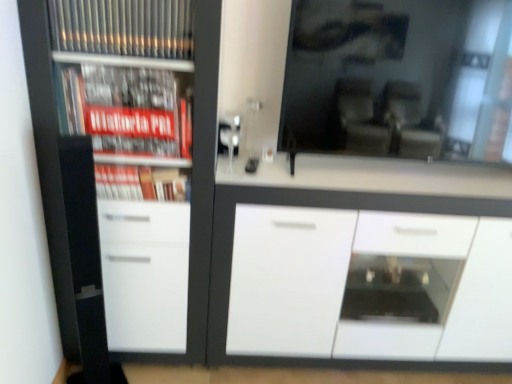
The height and width of the screenshot is (384, 512). Describe the element at coordinates (131, 161) in the screenshot. I see `white glossy cupboard at left` at that location.

At what (x,y) coordinates should I click in order to perform the action: click on white glossy cabinet at center. Please return your answer as a coordinate pair (x, y). Looking at the image, I should click on (360, 280).

At what (x,y) coordinates should I click in order to perform the action: click on white glossy cupboard at left. Please return your answer as a coordinate pair (x, y). The image size is (512, 384). Looking at the image, I should click on (131, 161).

What are the coordinates of `mirror behind the white glossy cupboard at left` in the screenshot? It's located at (399, 78).

Considering the positions of points (148, 350) and (308, 58), is point (148, 350) farther from camera compared to point (308, 58)?

Yes, it is behind point (308, 58).

How different are the orientations of white glossy cupboard at left and transparent glass mirror at upper center in degrees?

They differ by 0.208 degrees in their facing directions.

Considering the sizes of objects white glossy cupboard at left and transparent glass mirror at upper center in the image provided, who is bigger, white glossy cupboard at left or transparent glass mirror at upper center?

With larger size is white glossy cupboard at left.

Is point (259, 311) farther from camera compared to point (379, 144)?

Yes.

Which object is thinner, white glossy cabinet at center or transparent glass mirror at upper center?

Thinner between the two is transparent glass mirror at upper center.

From a real-world perspective, is white glossy cabinet at center above or below transparent glass mirror at upper center?

From a real-world perspective, white glossy cabinet at center is physically below transparent glass mirror at upper center.

Can you confirm if white glossy cabinet at center is thinner than white glossy cupboard at left?

No, white glossy cabinet at center is not thinner than white glossy cupboard at left.

Considering the positions of points (245, 311) and (54, 7), is point (245, 311) closer to camera compared to point (54, 7)?

That is False.

There is a white glossy cabinet at center. At what (x,y) coordinates should I click in order to perform the action: click on cupboard above it (from a real-world perspective). Please return your answer as a coordinate pair (x, y). The width and height of the screenshot is (512, 384). Looking at the image, I should click on (131, 161).

Is white glossy cabinet at center spatially inside white glossy cupboard at left, or outside of it?

white glossy cabinet at center is outside white glossy cupboard at left.

How different are the orientations of transparent glass mirror at upper center and white glossy cupboard at left in degrees?

They differ by 0.208 degrees in their facing directions.

Between point (435, 39) and point (111, 289), which one is positioned in front?

The point (435, 39) is closer.

Are transparent glass mirror at upper center and white glossy cupboard at left located far from each other?

That's not correct — transparent glass mirror at upper center is a little close to white glossy cupboard at left.

Looking at this image, from a real-world perspective, who is located higher, transparent glass mirror at upper center or white glossy cupboard at left?

From a 3D spatial view, transparent glass mirror at upper center is above.

Is white glossy cupboard at left completely or partially outside of white glossy cabinet at center?

white glossy cupboard at left lies outside white glossy cabinet at center's area.

Is white glossy cupboard at left turned away from white glossy cabinet at center?

white glossy cupboard at left is not turned away from white glossy cabinet at center.

Relative to white glossy cabinet at center, is white glossy cupboard at left in front or behind?

In the image, white glossy cupboard at left appears in front of white glossy cabinet at center.

From the image's perspective, is white glossy cupboard at left under white glossy cabinet at center?

No, from the image's perspective, white glossy cupboard at left is not below white glossy cabinet at center.

Between point (381, 44) and point (383, 241), which one is positioned in front?

Point (381, 44)

From the image's perspective, which is below, transparent glass mirror at upper center or white glossy cabinet at center?

white glossy cabinet at center is shown below in the image.

In the scene shown: Could you tell me if transparent glass mirror at upper center is facing white glossy cabinet at center?

No.

The image size is (512, 384). Find the location of `mirror in front of the white glossy cabinet at center`. mirror in front of the white glossy cabinet at center is located at coordinates (399, 78).

Where is `mirror located above the white glossy cupboard at left (from a real-world perspective)`? mirror located above the white glossy cupboard at left (from a real-world perspective) is located at coordinates (399, 78).

Find the location of a particular element. The image size is (512, 384). mirror located in front of the white glossy cabinet at center is located at coordinates (399, 78).

Based on their spatial positions, is transparent glass mirror at upper center or white glossy cupboard at left closer to white glossy cabinet at center?

Based on the image, transparent glass mirror at upper center appears to be nearer to white glossy cabinet at center.

Considering their positions, is white glossy cabinet at center positioned closer to transparent glass mirror at upper center than white glossy cupboard at left?

Among the two, white glossy cabinet at center is located nearer to transparent glass mirror at upper center.

Estimate the real-world distances between objects in this image. Which object is further from transparent glass mirror at upper center, white glossy cupboard at left or white glossy cabinet at center?

white glossy cupboard at left.

Looking at the image, which one is located further to white glossy cupboard at left, white glossy cabinet at center or transparent glass mirror at upper center?

Based on the image, transparent glass mirror at upper center appears to be further to white glossy cupboard at left.

Which object lies nearer to the anchor point white glossy cabinet at center, white glossy cupboard at left or transparent glass mirror at upper center?

transparent glass mirror at upper center is closer to white glossy cabinet at center.

When comparing their distances from white glossy cupboard at left, does transparent glass mirror at upper center or white glossy cabinet at center seem closer?

Based on the image, white glossy cabinet at center appears to be nearer to white glossy cupboard at left.

Identify the location of cabinetry between white glossy cupboard at left and transparent glass mirror at upper center from left to right. (360, 280).